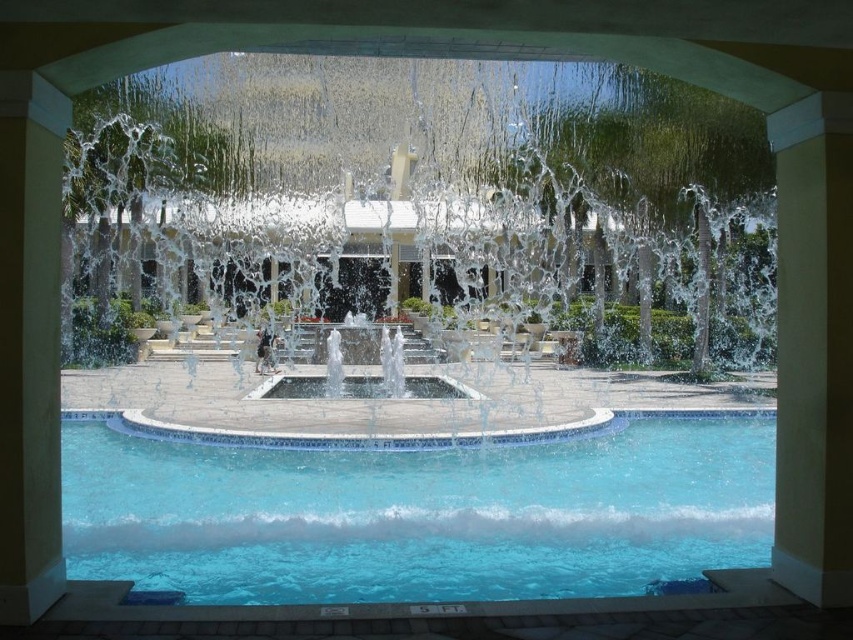
Which is below, clear glass water at center or clear glass swimming pool at lower center?

clear glass swimming pool at lower center

Is point (186, 568) positioned after point (221, 516)?

That is False.

Is point (350, 586) positioned in front of point (244, 516)?

Yes, it is.

Locate an element on the screen. The width and height of the screenshot is (853, 640). clear glass water at center is located at coordinates (430, 340).

In the scene shown: Can you confirm if clear glass swimming pool at lower center is wider than yellow smooth pillar at left?

Correct, the width of clear glass swimming pool at lower center exceeds that of yellow smooth pillar at left.

Does clear glass swimming pool at lower center have a lesser height compared to yellow smooth pillar at left?

Indeed, clear glass swimming pool at lower center has a lesser height compared to yellow smooth pillar at left.

Between point (514, 529) and point (39, 392), which one is positioned in front?

Point (39, 392) is in front.

Identify the location of clear glass swimming pool at lower center. (418, 509).

Can you confirm if clear glass water at center is taller than clear glass fountain at center?

Yes, clear glass water at center is taller than clear glass fountain at center.

Does clear glass water at center have a larger size compared to clear glass fountain at center?

Yes.

This screenshot has width=853, height=640. I want to click on clear glass water at center, so click(430, 340).